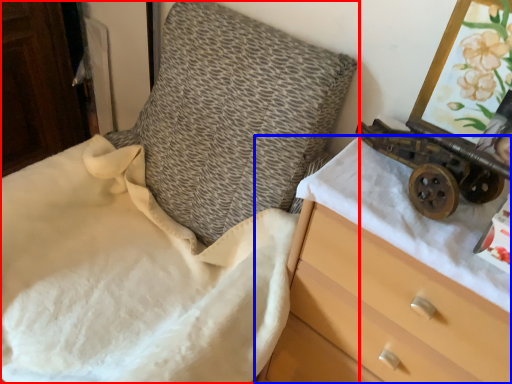
Question: Which point is closer to the camera, furniture (highlighted by a red box) or chest of drawers (highlighted by a blue box)?

Choices:
 (A) furniture
 (B) chest of drawers

Answer: (A)